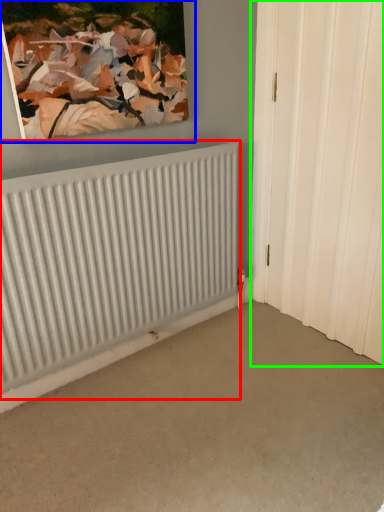
Question: Which is nearer to the radiator (highlighted by a red box)? picture frame (highlighted by a blue box) or door (highlighted by a green box).

Choices:
 (A) picture frame
 (B) door

Answer: (A)